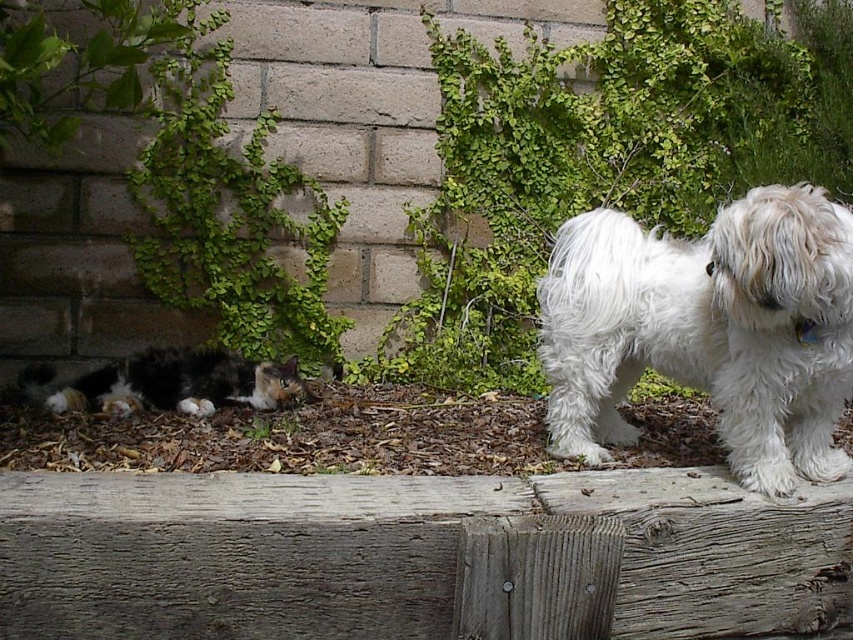
Question: Which of the following is the closest to the observer?

Choices:
 (A) calico fur cat at lower left
 (B) white fluffy dog at right

Answer: (B)

Question: Where is white fluffy dog at right located in relation to calico fur cat at lower left in the image?

Choices:
 (A) right
 (B) left

Answer: (A)

Question: Among these objects, which one is farthest from the camera?

Choices:
 (A) white fluffy dog at right
 (B) calico fur cat at lower left

Answer: (B)

Question: Which point is closer to the camera?

Choices:
 (A) (242, 396)
 (B) (788, 362)

Answer: (B)

Question: Is white fluffy dog at right positioned before calico fur cat at lower left?

Choices:
 (A) yes
 (B) no

Answer: (A)

Question: Can you confirm if white fluffy dog at right is positioned above calico fur cat at lower left?

Choices:
 (A) yes
 (B) no

Answer: (A)